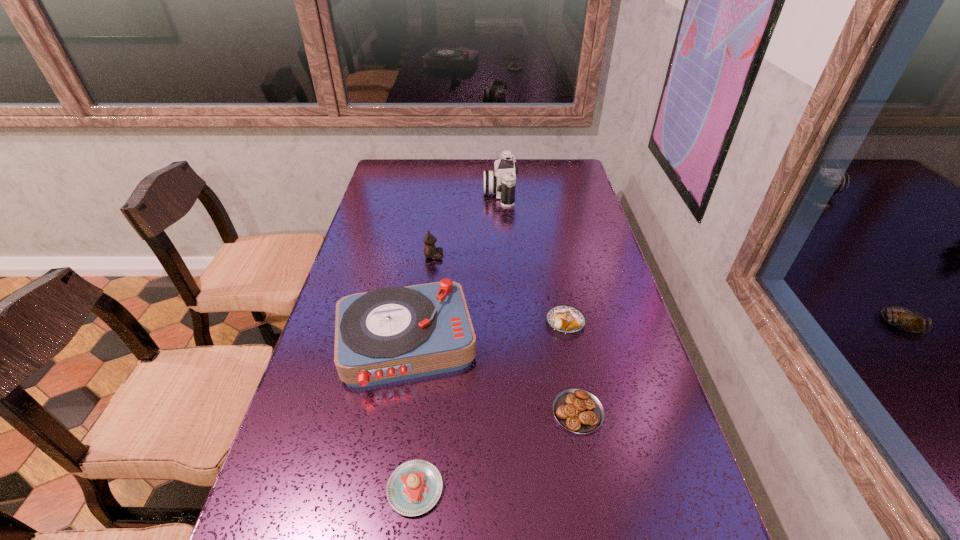
This screenshot has width=960, height=540. Find the location of `free point located on the front of the second tallest object`. free point located on the front of the second tallest object is located at coordinates (383, 483).

Identify the location of vacant space located 0.130m on the face of the teddy bear. Image resolution: width=960 pixels, height=540 pixels. (484, 256).

Where is `vacant space situated on the back of the farthest pastry`? The width and height of the screenshot is (960, 540). vacant space situated on the back of the farthest pastry is located at coordinates (557, 278).

Locate an element on the screen. Image resolution: width=960 pixels, height=540 pixels. free region located 0.290m on the right of the nearest object is located at coordinates tap(590, 489).

At what (x,y) coordinates should I click in order to perform the action: click on vacant space positioned on the left of the second farthest pastry. Please return your answer as a coordinate pair (x, y). This screenshot has width=960, height=540. Looking at the image, I should click on (477, 412).

Find the location of a particular element. The width and height of the screenshot is (960, 540). object located in the far edge section of the desktop is located at coordinates (502, 181).

I want to click on object present at the left edge, so click(x=390, y=334).

Locate an element on the screen. This screenshot has height=540, width=960. vacant space at the far edge of the desktop is located at coordinates (429, 167).

I want to click on vacant space at the left edge of the desktop, so click(353, 470).

At what (x,y) coordinates should I click in order to perform the action: click on vacant area at the right edge of the desktop. Please return your answer as a coordinate pair (x, y). Image resolution: width=960 pixels, height=540 pixels. Looking at the image, I should click on (700, 532).